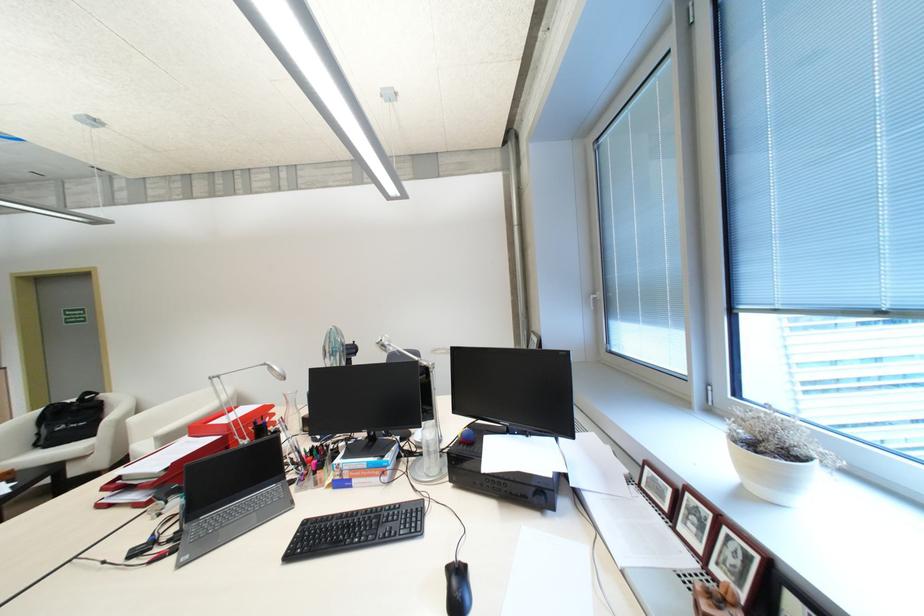
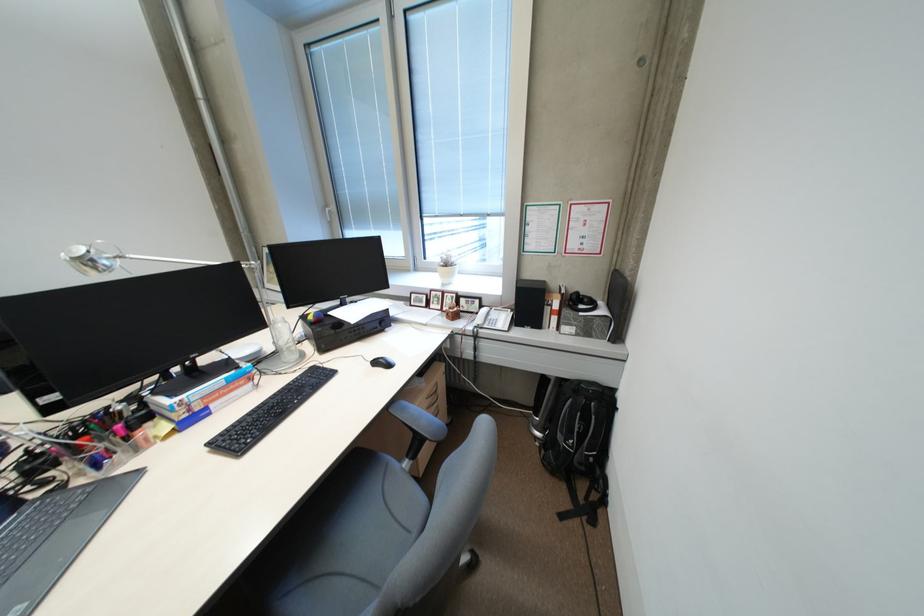
Locate, in the second image, the point that corresponds to [387,342] in the first image.

(90, 257)